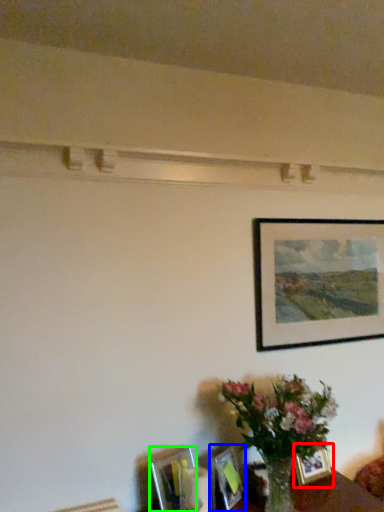
Question: Which object is the farthest from picture frame (highlighted by a red box)? Choose among these: picture frame (highlighted by a blue box) or picture frame (highlighted by a green box).

Choices:
 (A) picture frame
 (B) picture frame

Answer: (B)